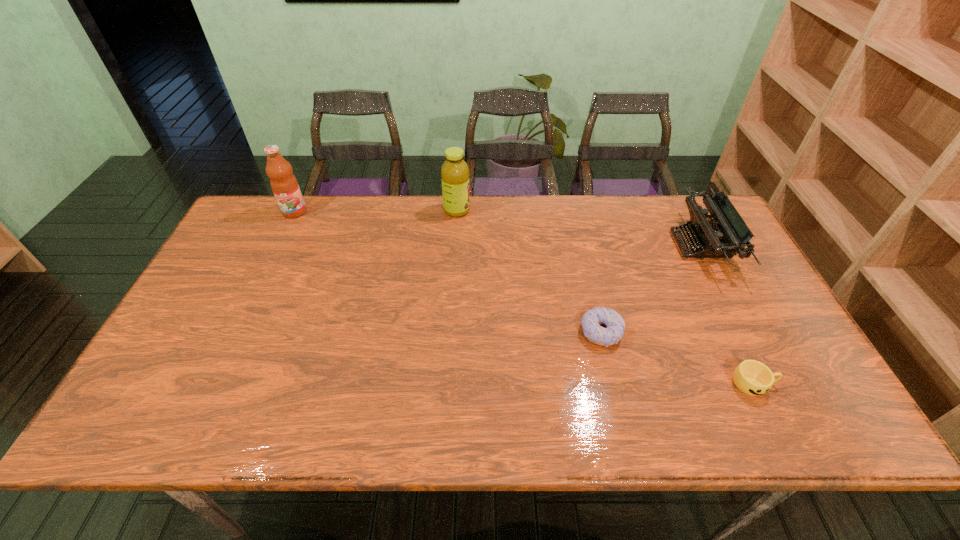
Find the location of `blank region between the leftmost object and the second nearest object`. blank region between the leftmost object and the second nearest object is located at coordinates (447, 272).

Locate an element on the screen. This screenshot has height=540, width=960. free space between the doughnut and the typewriter is located at coordinates (651, 288).

What are the coordinates of `free point between the cup and the leftmost object` in the screenshot? It's located at (524, 298).

Where is `vacant area that lies between the left fruit juice and the typewriter`? vacant area that lies between the left fruit juice and the typewriter is located at coordinates (497, 228).

Find the location of a particular element. free point between the third shortest object and the fourth object from right to left is located at coordinates [579, 227].

This screenshot has height=540, width=960. In order to click on free space between the fourth farthest object and the fourth object from right to left in this screenshot , I will do `click(529, 271)`.

Locate which object ranks second in proximity to the fourth farthest object. Please provide its 2D coordinates. Your answer should be formatted as a tuple, i.e. [(x, y)], where the tuple contains the x and y coordinates of a point satisfying the conditions above.

[(725, 235)]

Select which object is the closest to the second nearest object. Please provide its 2D coordinates. Your answer should be formatted as a tuple, i.e. [(x, y)], where the tuple contains the x and y coordinates of a point satisfying the conditions above.

[(752, 377)]

This screenshot has width=960, height=540. I want to click on blank space that satisfies the following two spatial constraints: 1. on the front label of the left fruit juice; 2. on the right side of the cup, so click(213, 384).

You are a GUI agent. You are given a task and a screenshot of the screen. Output one action in this format:
    pyautogui.click(x=<x>, y=<y>)
    Task: Click on the vacant point that satisfies the following two spatial constraints: 1. on the front label of the right fruit juice; 2. on the left side of the third object from left to right
    The image size is (960, 540).
    Given the screenshot: What is the action you would take?
    pyautogui.click(x=449, y=332)